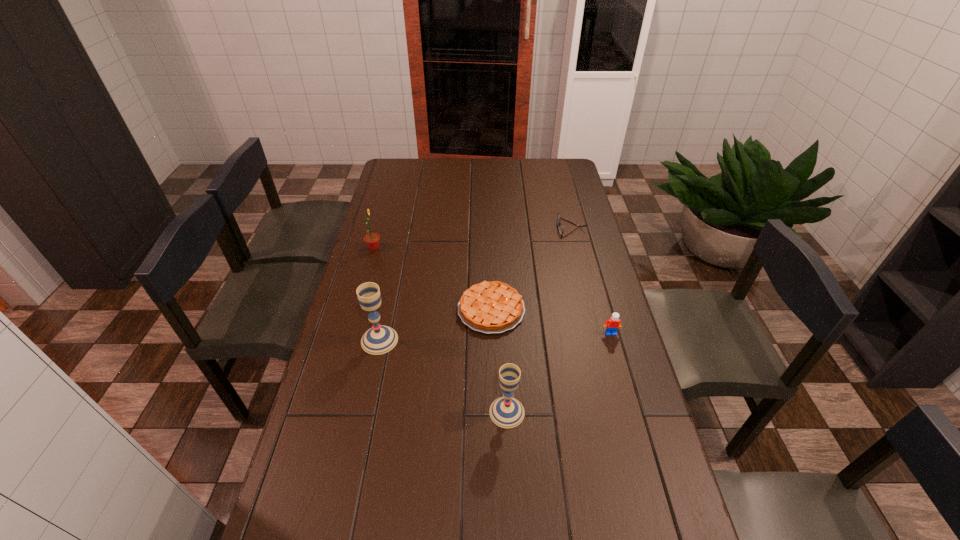
This screenshot has width=960, height=540. What are the coordinates of `Lego at the right edge` in the screenshot? It's located at (612, 325).

Locate an element on the screen. vacant region at the far edge of the desktop is located at coordinates (424, 159).

Find the location of a particular element. Image resolution: width=960 pixels, height=540 pixels. vacant region at the near edge of the desktop is located at coordinates (572, 505).

You are a GUI agent. You are given a task and a screenshot of the screen. Output one action in this format:
    pyautogui.click(x=<x>, y=<y>)
    Task: Click on the free space at the left edge
    
    Given the screenshot: What is the action you would take?
    pyautogui.click(x=361, y=348)

In the image, there is a desktop. At what (x,y) coordinates should I click in order to perform the action: click on vacant space at the right edge. Please return your answer as a coordinate pair (x, y). Looking at the image, I should click on (580, 308).

In the image, there is a desktop. Where is `vacant space at the far left corner`? The height and width of the screenshot is (540, 960). vacant space at the far left corner is located at coordinates (391, 169).

Identify the location of free space at the far right corner of the desktop. (545, 182).

Find the location of a particular element. The height and width of the screenshot is (540, 960). vacant point located between the shorter chalice and the farthest object is located at coordinates (540, 320).

Locate an element on the screen. Image resolution: width=960 pixels, height=540 pixels. empty location between the Lego and the shorter chalice is located at coordinates point(559,373).

In order to click on free space between the taller chalice and the farthest object in this screenshot , I will do `click(475, 284)`.